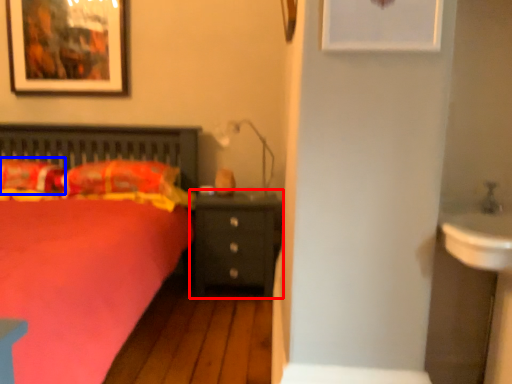
Question: Which of the following is the farthest to the observer, nightstand (highlighted by a red box) or pillow (highlighted by a blue box)?

Choices:
 (A) nightstand
 (B) pillow

Answer: (A)